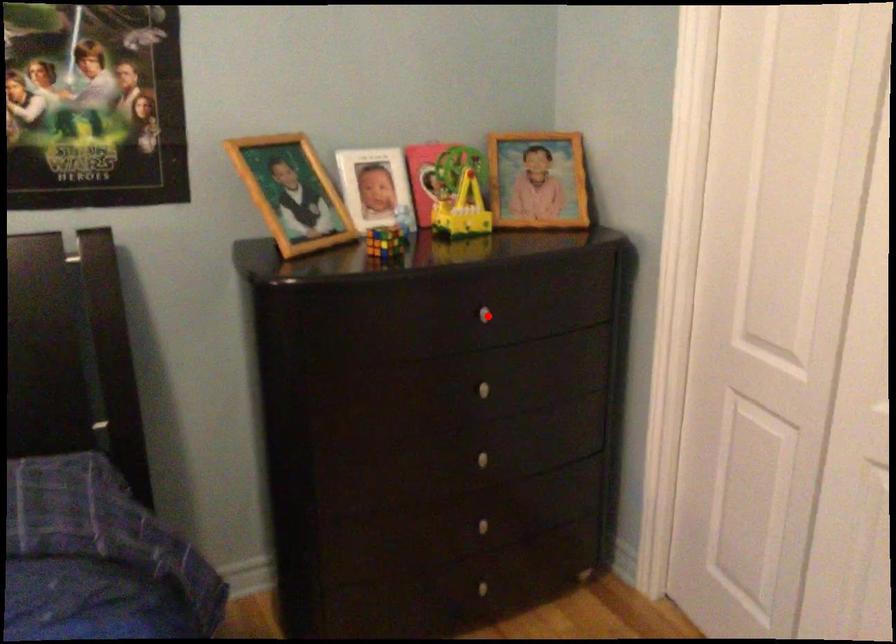
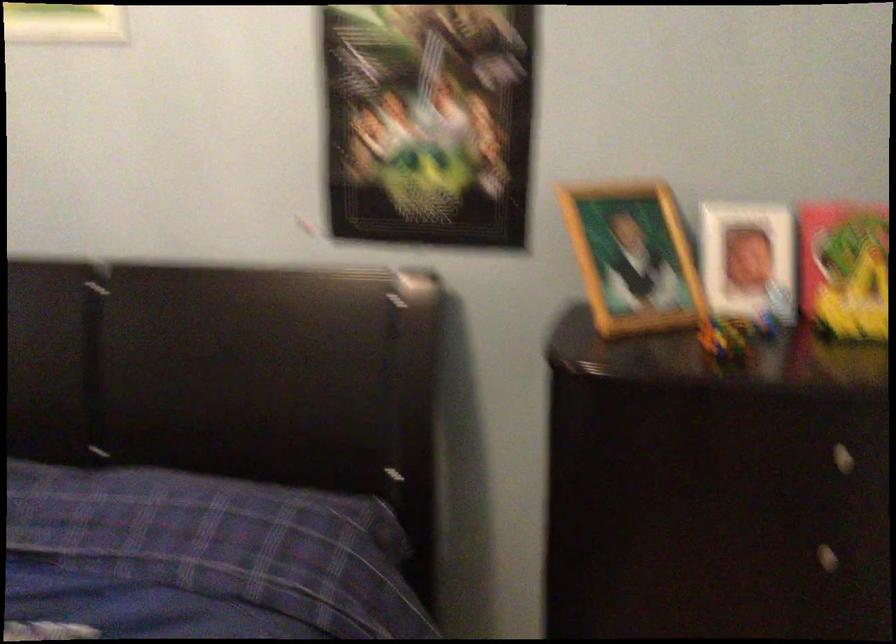
Where in the second image is the point corresponding to the highlighted location from the first image?

(840, 458)